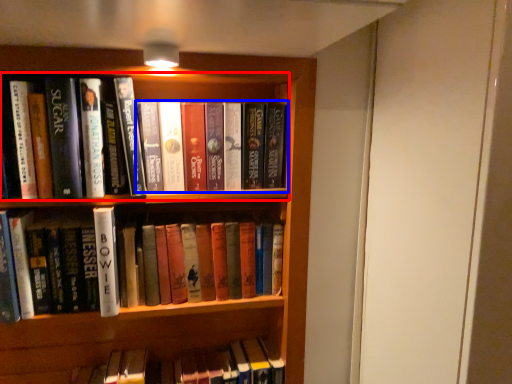
Question: Which object appears farthest to the camera in this image, book (highlighted by a red box) or book (highlighted by a blue box)?

Choices:
 (A) book
 (B) book

Answer: (B)